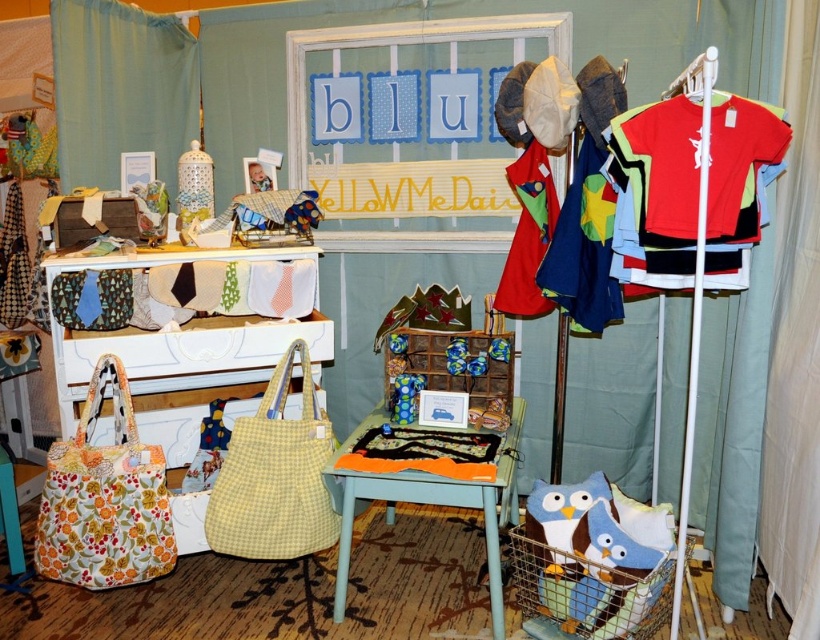
Question: Which point is closer to the camera taking this photo?

Choices:
 (A) (253, 486)
 (B) (643, 131)
 (C) (485, 534)
 (D) (541, 252)

Answer: (B)

Question: Which object is the farthest from the red cotton t-shirt at right?

Choices:
 (A) blue cotton shirt at right
 (B) yellow gingham tote at center
 (C) white fabric curtain at right

Answer: (B)

Question: Can you confirm if white fabric curtain at right is bigger than wooden table at center?

Choices:
 (A) no
 (B) yes

Answer: (A)

Question: Considering the relative positions of blue cotton shirt at right and red cotton t-shirt at center in the image provided, where is blue cotton shirt at right located with respect to red cotton t-shirt at center?

Choices:
 (A) below
 (B) above

Answer: (A)

Question: Which of the following is the farthest from the observer?

Choices:
 (A) (x=764, y=508)
 (B) (x=253, y=470)
 (C) (x=581, y=189)

Answer: (C)

Question: Is red cotton t-shirt at right behind floral fabric tote at lower left?

Choices:
 (A) no
 (B) yes

Answer: (A)